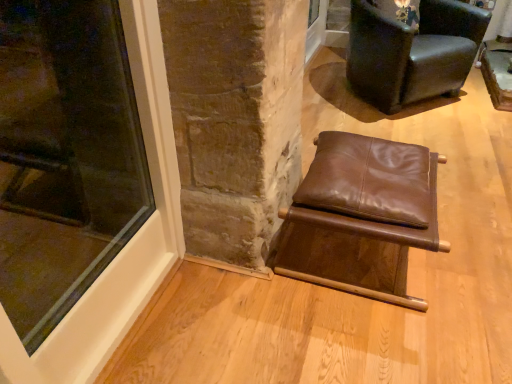
Question: Is point (352, 235) positioned closer to the camera than point (434, 56)?

Choices:
 (A) closer
 (B) farther

Answer: (A)

Question: Considering the relative positions of brown leather stool at center, the 1th chair from the front, and dark brown leather chair at upper right, which appears as the first chair when viewed from the top, in the image provided, is brown leather stool at center, the 1th chair from the front, to the left or to the right of dark brown leather chair at upper right, which appears as the first chair when viewed from the top,?

Choices:
 (A) right
 (B) left

Answer: (B)

Question: Based on their relative distances, which object is nearer to the dark brown leather chair at upper right, placed as the first chair when sorted from back to front?

Choices:
 (A) brown leather stool at center, the 1th chair from the front
 (B) transparent glass window at lower left

Answer: (A)

Question: Which of these objects is positioned closest to the brown leather stool at center, marked as the 1th chair in a bottom-to-top arrangement?

Choices:
 (A) transparent glass window at lower left
 (B) dark brown leather chair at upper right, the second chair when ordered from bottom to top

Answer: (A)